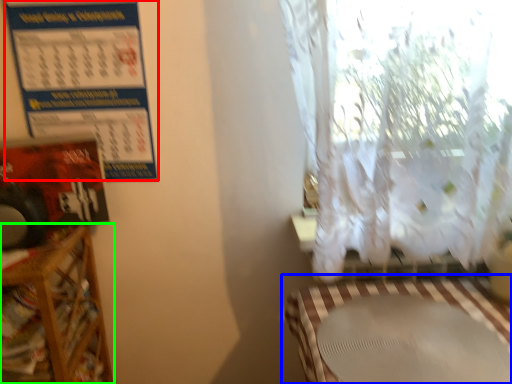
Question: Which is nearer to the calendar (highlighted by a red box)? table (highlighted by a blue box) or furniture (highlighted by a green box).

Choices:
 (A) table
 (B) furniture

Answer: (B)